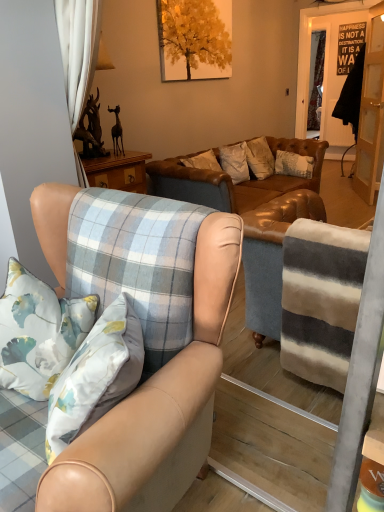
Find the location of a particular element. This screenshot has width=384, height=512. leather couch at center is located at coordinates (252, 218).

At what (x,y) coordinates should I click in order to perform the action: click on light brown leather armchair at center. Please return your answer as a coordinate pair (x, y). The image size is (384, 512). Looking at the image, I should click on (158, 405).

Find the location of `leather couch at center`. leather couch at center is located at coordinates (252, 218).

Is leather couch at center looking in the opposite direction of clear glass door at right?

That's not correct — leather couch at center is not looking away from clear glass door at right.

Between leather couch at center and clear glass door at right, which one has smaller size?

Smaller between the two is clear glass door at right.

Which is nearer, (175, 164) or (365, 65)?

The point (175, 164) is in front.

Looking at this image, from a real-world perspective, is leather couch at center on top of white floral pillow at left?

No.

Who is taller, leather couch at center or white floral pillow at left?

Standing taller between the two is leather couch at center.

Between point (275, 250) and point (32, 326), which one is positioned in front?

The point (32, 326) is more forward.

Is light brown leather armchair at center at the left side of leather couch at center?

Yes, light brown leather armchair at center is to the left of leather couch at center.

Who is taller, light brown leather armchair at center or leather couch at center?

Standing taller between the two is light brown leather armchair at center.

From a real-world perspective, is light brown leather armchair at center under leather couch at center?

No.

Between light brown leather armchair at center and leather couch at center, which one has larger width?

With larger width is leather couch at center.

Is light brown leather armchair at center taller than white floral pillow at left?

Indeed, light brown leather armchair at center has a greater height compared to white floral pillow at left.

What's the angular difference between light brown leather armchair at center and white floral pillow at left's facing directions?

There is a 41-degree angle between the facing directions of light brown leather armchair at center and white floral pillow at left.

Is white floral pillow at left at the back of light brown leather armchair at center?

Yes, light brown leather armchair at center's orientation is away from white floral pillow at left.

Is point (111, 476) positioned in front of point (36, 329)?

Yes, point (111, 476) is in front of point (36, 329).

Is light brown leather armchair at center far from clear glass door at right?

Absolutely, light brown leather armchair at center is distant from clear glass door at right.

Which object is further away from the camera, light brown leather armchair at center or clear glass door at right?

Positioned behind is clear glass door at right.

Is light brown leather armchair at center positioned beyond the bounds of clear glass door at right?

light brown leather armchair at center lies outside clear glass door at right's area.

Which of these two, light brown leather armchair at center or clear glass door at right, is wider?

Wider between the two is light brown leather armchair at center.

From a real-world perspective, is clear glass door at right physically located above or below leather couch at center?

clear glass door at right is above leather couch at center.

Can you confirm if clear glass door at right is wider than leather couch at center?

Incorrect, the width of clear glass door at right does not surpass that of leather couch at center.

Between clear glass door at right and leather couch at center, which one has more height?

Standing taller between the two is clear glass door at right.

Could you tell me if clear glass door at right is facing leather couch at center?

No, clear glass door at right does not turn towards leather couch at center.

Is white floral pillow at left positioned with its back to light brown leather armchair at center?

Yes.

Who is smaller, white floral pillow at left or light brown leather armchair at center?

With smaller size is white floral pillow at left.

From a real-world perspective, is white floral pillow at left positioned under light brown leather armchair at center based on gravity?

No, from a real-world perspective, white floral pillow at left is not beneath light brown leather armchair at center.

From the image's perspective, is white floral pillow at left above light brown leather armchair at center?

Correct, white floral pillow at left appears higher than light brown leather armchair at center in the image.

Image resolution: width=384 pixels, height=512 pixels. I want to click on studio couch that appears below the clear glass door at right (from the image's perspective), so click(x=252, y=218).

Where is `studio couch on the right side of white floral pillow at left`? Image resolution: width=384 pixels, height=512 pixels. studio couch on the right side of white floral pillow at left is located at coordinates coord(252,218).

When comparing their distances from leather couch at center, does white floral pillow at left or light brown leather armchair at center seem further?

Based on the image, light brown leather armchair at center appears to be further to leather couch at center.

From the image, which object appears to be nearer to light brown leather armchair at center, white floral pillow at left or leather couch at center?

Among the two, white floral pillow at left is located nearer to light brown leather armchair at center.

Looking at this image, when comparing their distances from clear glass door at right, does light brown leather armchair at center or leather couch at center seem further?

light brown leather armchair at center is positioned further to the anchor clear glass door at right.

From the image, which object appears to be farther from leather couch at center, light brown leather armchair at center or white floral pillow at left?

Based on the image, light brown leather armchair at center appears to be further to leather couch at center.

Considering their positions, is clear glass door at right positioned further to leather couch at center than white floral pillow at left?

white floral pillow at left is positioned further to the anchor leather couch at center.

Considering their positions, is white floral pillow at left positioned closer to clear glass door at right than leather couch at center?

Based on the image, leather couch at center appears to be nearer to clear glass door at right.

Which object lies nearer to the anchor point white floral pillow at left, leather couch at center or light brown leather armchair at center?

light brown leather armchair at center is closer to white floral pillow at left.

When comparing their distances from light brown leather armchair at center, does leather couch at center or clear glass door at right seem closer?

The object closer to light brown leather armchair at center is leather couch at center.

Find the location of a particular element. This screenshot has height=512, width=384. pillow between light brown leather armchair at center and clear glass door at right along the z-axis is located at coordinates (38, 332).

Where is `studio couch between white floral pillow at left and clear glass door at right from front to back`? studio couch between white floral pillow at left and clear glass door at right from front to back is located at coordinates (252, 218).

Where is `pillow between light brown leather armchair at center and leather couch at center along the z-axis`? The height and width of the screenshot is (512, 384). pillow between light brown leather armchair at center and leather couch at center along the z-axis is located at coordinates (38, 332).

Where is `studio couch positioned between light brown leather armchair at center and clear glass door at right from near to far`? The image size is (384, 512). studio couch positioned between light brown leather armchair at center and clear glass door at right from near to far is located at coordinates (252, 218).